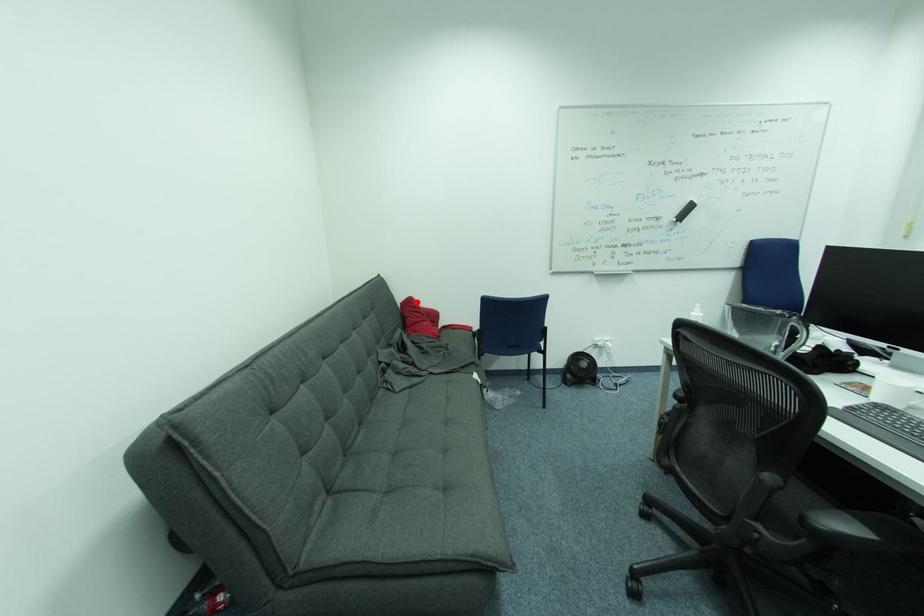
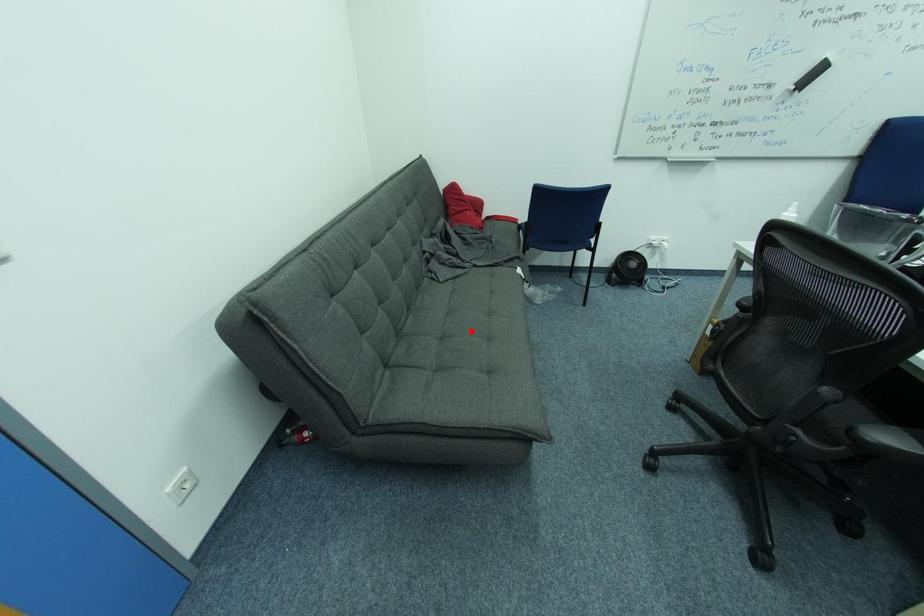
I am providing you with two images of the same scene from different viewpoints. A red point is marked on the first image and another point is marked on the second image. Are the points marked in image1 and image2 representing the same 3D position?

No